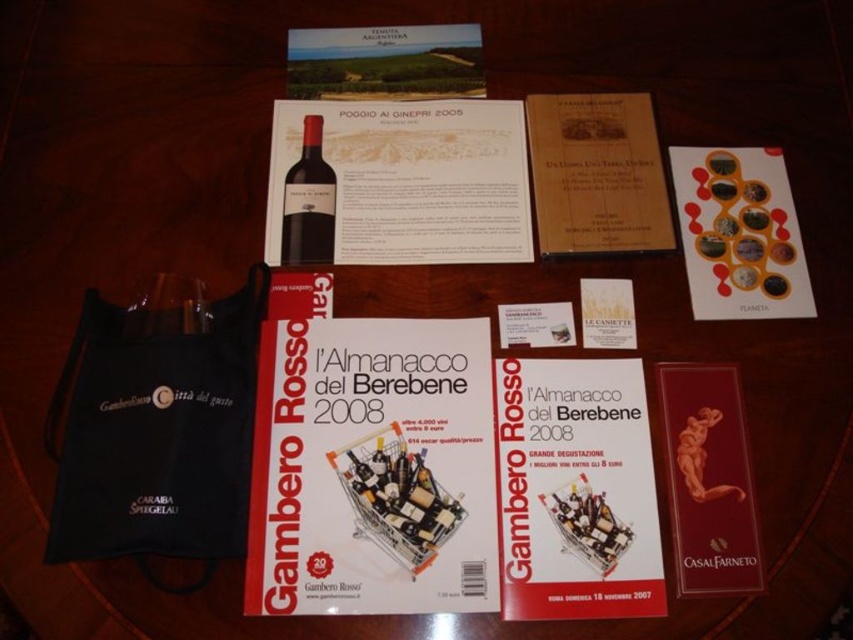
Does matte paper wine at upper center appear under shiny dark red bottle at center?

No, matte paper wine at upper center is not below shiny dark red bottle at center.

Is point (485, 250) positioned after point (309, 156)?

No, (485, 250) is in front of (309, 156).

You are a GUI agent. You are given a task and a screenshot of the screen. Output one action in this format:
    pyautogui.click(x=<x>, y=<y>)
    Task: Click on the matte paper wine at upper center
    This screenshot has height=640, width=853.
    Given the screenshot: What is the action you would take?
    pyautogui.click(x=415, y=179)

Consider the image. Who is shorter, wooden menu at upper center or matte paper menu at upper center?

matte paper menu at upper center

Between wooden menu at upper center and matte paper menu at upper center, which one is positioned lower?

wooden menu at upper center

Does point (541, 138) come closer to viewer compared to point (309, 33)?

Yes, point (541, 138) is in front of point (309, 33).

The image size is (853, 640). What are the coordinates of `wooden menu at upper center` in the screenshot? It's located at (596, 173).

Who is positioned more to the left, red glossy book at center or white paper at center?

red glossy book at center

Who is more forward, (x=489, y=465) or (x=628, y=435)?

Point (x=489, y=465) is more forward.

Image resolution: width=853 pixels, height=640 pixels. In order to click on red glossy book at center in this screenshot , I will do `click(372, 468)`.